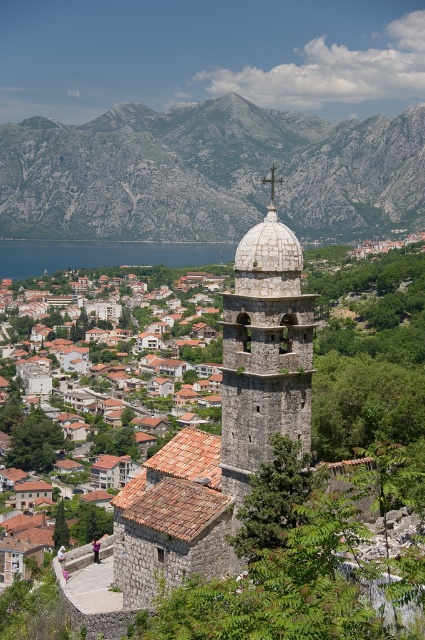
You are standing at the point closest to the church tower and want to walk towards the water. Which point should you head to first, point (200,484) or point (14,268)?

You should head to point (14,268) first because point (200,484) is in front of point (14,268), meaning point (14,268) is further back towards the water.

You are standing at the base of the stone church tower in the foreground. Looking towards the upper center, you notice a point marked at coordinates [209,172]. What geographical feature does this point represent?

The point at [209,172] indicates a gray rocky mountain at upper center.

You are a photographer planning to capture the stone dome at center and the gray rocky mountain at upper center in a single frame. Based on their heights, which one will appear larger in the photo?

The gray rocky mountain at upper center is taller than the stone dome at center, so it will appear larger in the photo.